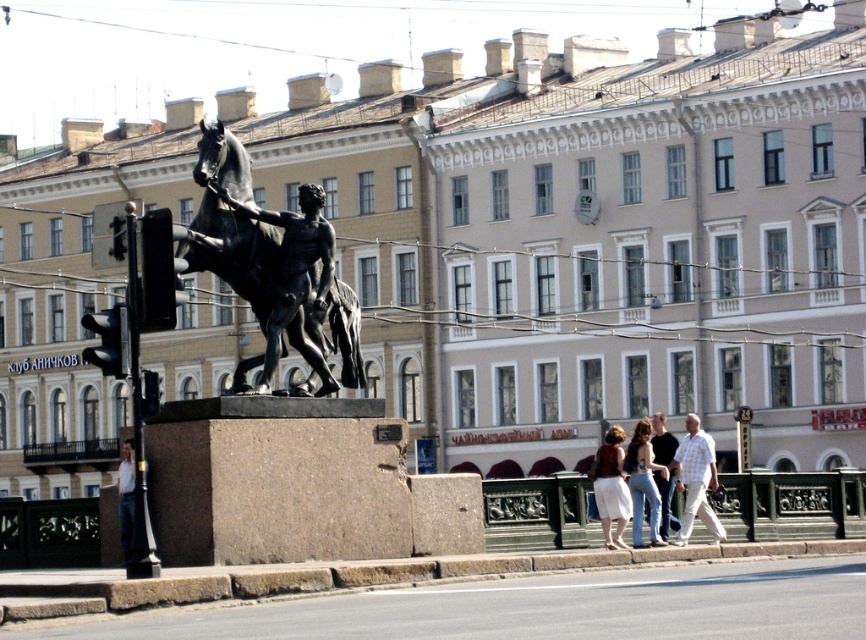
You are an urban planner assessing the central plaza. You notice the bronze statue at center and the white checkered shirt at center. Which object occupies a larger horizontal space in the scene?

The bronze statue at center has a greater width than the white checkered shirt at center, so it occupies a larger horizontal space in the scene.

You are an observer standing in front of the statue. You notice two items in the scene, the white checkered shirt at center and the white cotton skirt at lower center. Which item is shorter?

The white checkered shirt at center is not as tall as the white cotton skirt at lower center, so the white checkered shirt at center is shorter.